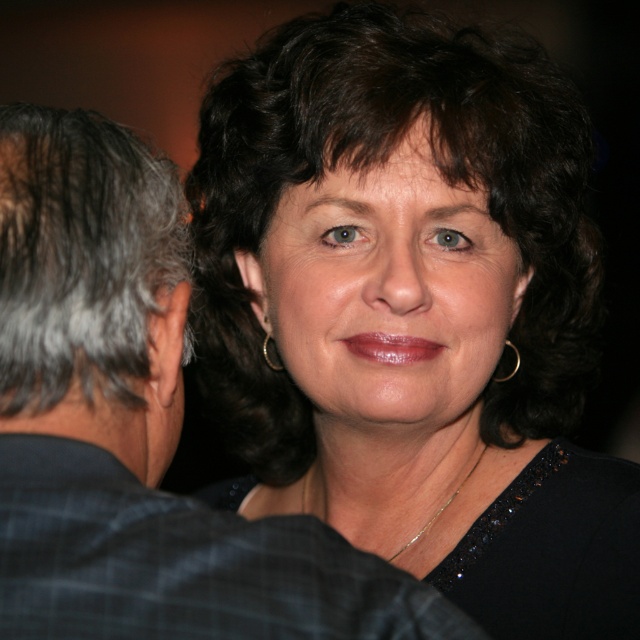
You are a photographer adjusting the focus on your camera. You notice the black fabric at center and the gold metallic earring at right in your viewfinder. Which object should you focus on to ensure the other is slightly blurred?

The black fabric at center is in front of the gold metallic earring at right, so focusing on the black fabric at center will keep it sharp while the gold metallic earring at right appears blurred.